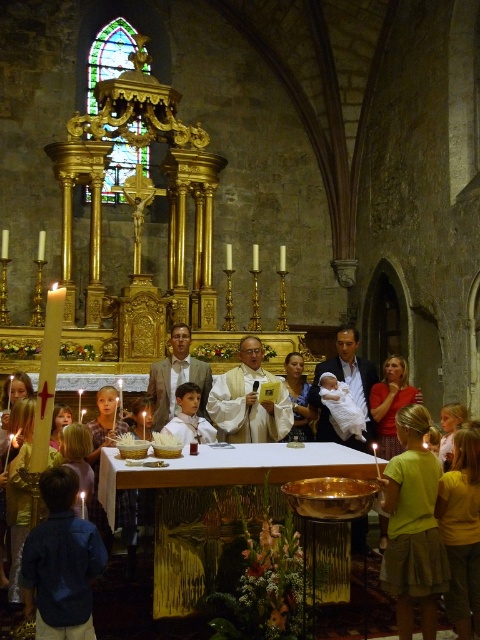
You are a photographer standing at the entrance of the church. You need to capture a photo that includes both the blue denim shirt at lower left and the white satin robe at center. Based on their positions, where should you position your camera to ensure both are visible in the frame?

The blue denim shirt at lower left is located below the white satin robe at center. To include both in the frame, position the camera at a lower angle so that the robe at center remains visible while capturing the shirt below it.

In the scene shown: You are a photographer standing at the entrance of the church, wanting to capture a photo of the gold polished table at center and the blue denim shirt at lower left in the same frame. The camera you are using has a maximum focus range of 5 meters. Will you be able to include both objects in your shot without moving closer?

The gold polished table at center and blue denim shirt at lower left are 5.43 meters apart from each other. Since the distance between them exceeds the camera maximum focus range of 5 meters, you will not be able to include both objects in the same frame without moving closer.